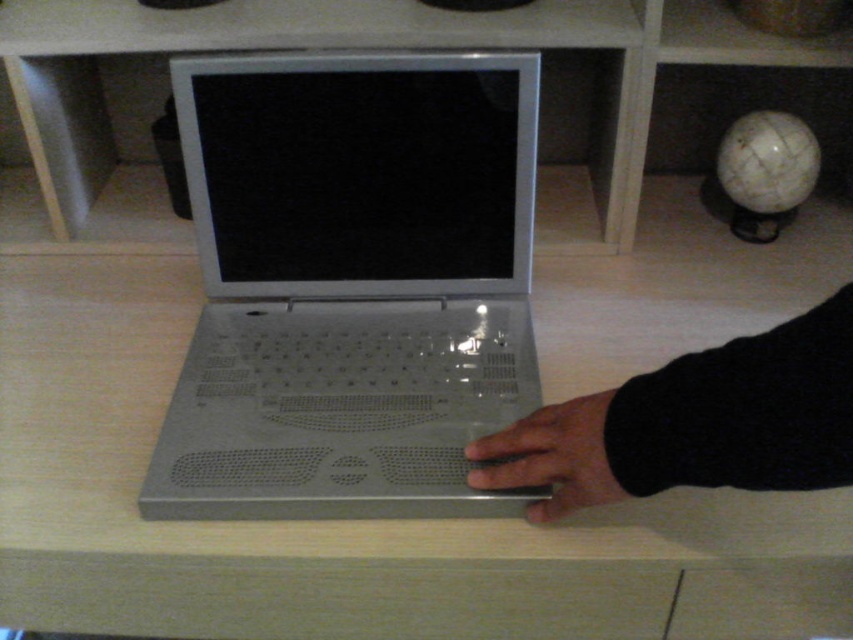
You are a user trying to access the laptop. Can you reach the matte silver laptop at center without moving the black matte hand at lower right?

The black matte hand at lower right is behind matte silver laptop at center, so you can reach the matte silver laptop at center without moving the hand because it is positioned behind the laptop.

What is the position of the point with coordinates (695,422) in relation to the black matte hand at lower right?

The point with coordinates (695,422) is located on the black matte hand at lower right.

In the scene shown: You are a user trying to place a mouse on the desk. The mouse is 10 cm wide. The desk has the matte silver laptop at center and the black matte hand at center. Is there enough space between the two objects to place the mouse?

The matte silver laptop at center is positioned on the left side of black matte hand at center. Since the mouse is 10 cm wide and the distance between the two objects isn